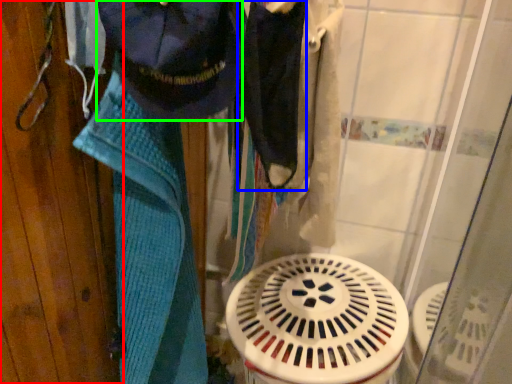
Question: Based on their relative distances, which object is farther from door (highlighted by a red box)? Choose from clothing (highlighted by a blue box) and clothing (highlighted by a green box).

Choices:
 (A) clothing
 (B) clothing

Answer: (A)